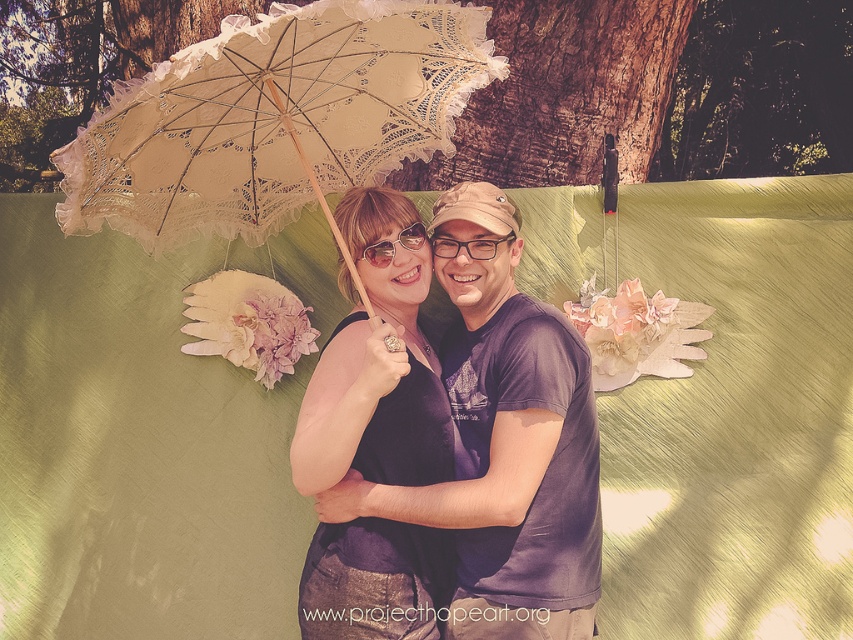
Question: In this image, where is brown textured tree trunk at upper center located relative to lace-covered beige umbrella at center?

Choices:
 (A) above
 (B) below

Answer: (A)

Question: Does purple cotton t-shirt at center come in front of matte black goggles at center?

Choices:
 (A) no
 (B) yes

Answer: (B)

Question: Among these objects, which one is farthest from the camera?

Choices:
 (A) purple cotton t-shirt at center
 (B) clear plastic glasses at center

Answer: (B)

Question: Which is farther from the matte black dress at center?

Choices:
 (A) brown textured tree trunk at upper center
 (B) purple cotton t-shirt at center
 (C) clear plastic glasses at center

Answer: (A)

Question: Which is farther from the purple cotton t-shirt at center?

Choices:
 (A) matte black goggles at center
 (B) matte black dress at center
 (C) lace-covered beige umbrella at center

Answer: (C)

Question: Can you confirm if brown textured tree trunk at upper center is bigger than matte black dress at center?

Choices:
 (A) no
 (B) yes

Answer: (A)